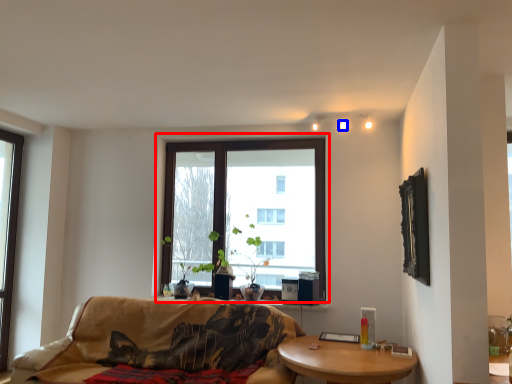
Question: Which of the following is the farthest to the observer, window (highlighted by a red box) or light (highlighted by a blue box)?

Choices:
 (A) window
 (B) light

Answer: (A)